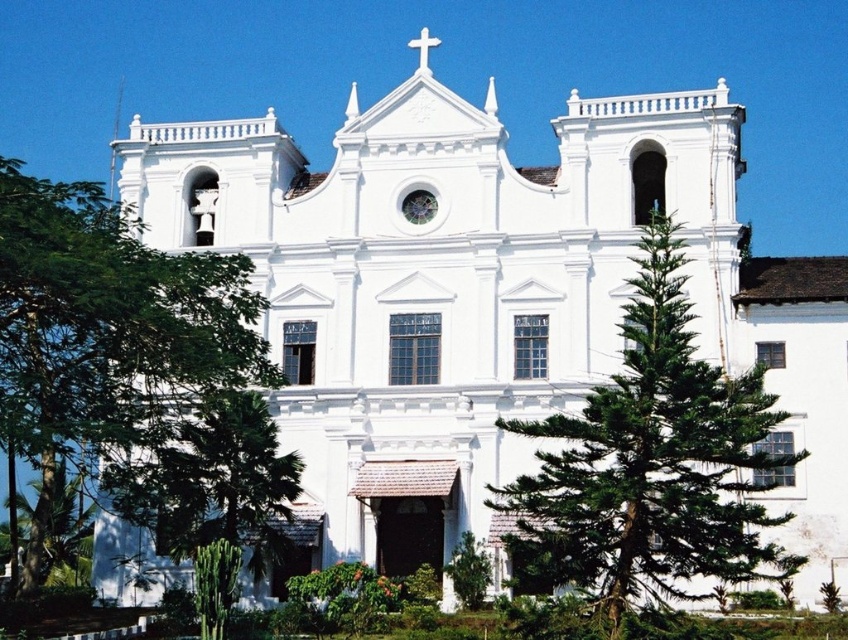
You are standing in front of the church and notice two green leafy trees. The first is labeled as the green leafy tree at left, and the second is the green leafy tree at lower left. Which tree is closer to you?

The green leafy tree at left is closer to you because it is positioned in front of the green leafy tree at lower left.

You are a visitor standing in front of the church and want to take a photo that includes both the green leafy tree at right and the green leafy tree at lower left. Which tree should you position closer to the center of your camera frame to ensure both are fully visible?

The green leafy tree at lower left should be positioned closer to the center of your camera frame because it is shorter than the green leafy tree at right, allowing both to be fully visible in the photo.

You are a landscape architect planning to add more trees to the church grounds. You notice the green leafy tree at left and the green leafy tree at right. Which tree is wider, and how might this affect your planting decisions?

The green leafy tree at left is wider than the green leafy tree at right. This suggests that the tree at left may require more space, so you should consider planting additional trees farther from it to avoid overcrowding.